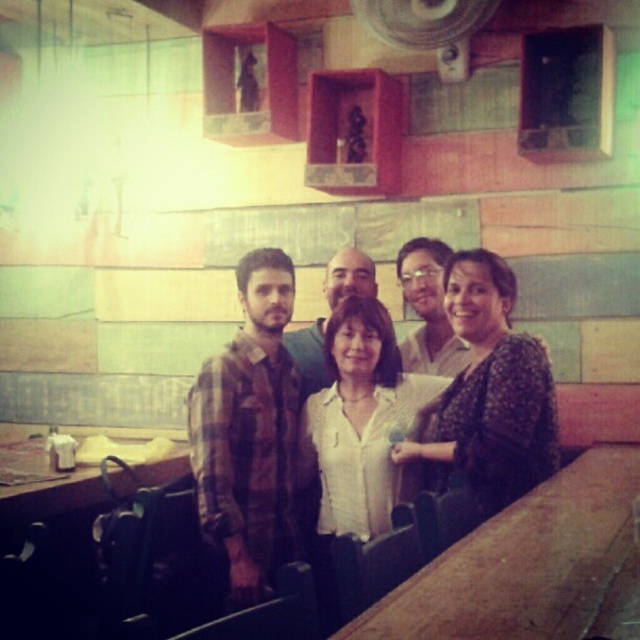
Question: Estimate the real-world distances between objects in this image. Which object is farther from the matte brown shirt at center?

Choices:
 (A) white cotton shirt at center
 (B) floral-patterned blouse at center

Answer: (B)

Question: Can you confirm if floral-patterned blouse at center is positioned below white cotton shirt at center?

Choices:
 (A) no
 (B) yes

Answer: (B)

Question: Is floral-patterned blouse at center positioned in front of white cotton shirt at center?

Choices:
 (A) yes
 (B) no

Answer: (A)

Question: Which point appears closest to the camera in this image?

Choices:
 (A) (432, 300)
 (B) (285, 288)

Answer: (B)

Question: Can you confirm if plaid fabric shirt at center is positioned to the right of floral-patterned blouse at center?

Choices:
 (A) yes
 (B) no

Answer: (B)

Question: Which object is the closest to the floral-patterned blouse at center?

Choices:
 (A) white matte shirt at center
 (B) plaid shirt at center
 (C) plaid fabric shirt at center
 (D) white cotton shirt at center

Answer: (A)